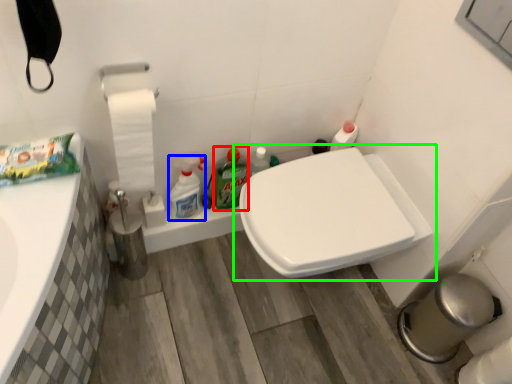
Question: Which object is the closest to the cleaning product (highlighted by a red box)? Choose among these: cleaning product (highlighted by a blue box) or toilet (highlighted by a green box).

Choices:
 (A) cleaning product
 (B) toilet

Answer: (A)